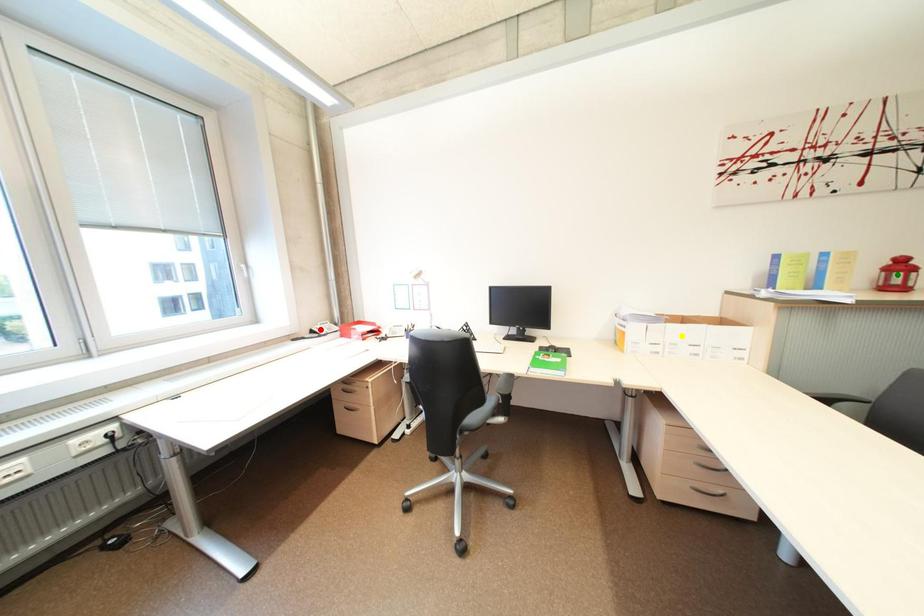
Order these from nearest to farthest:
yellow point, red point, green point

green point
yellow point
red point